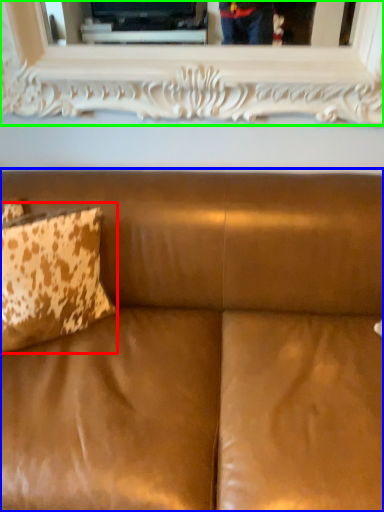
Question: Which object is positioned closest to pillow (highlighted by a red box)? Select from studio couch (highlighted by a blue box) and picture frame (highlighted by a green box).

Choices:
 (A) studio couch
 (B) picture frame

Answer: (A)